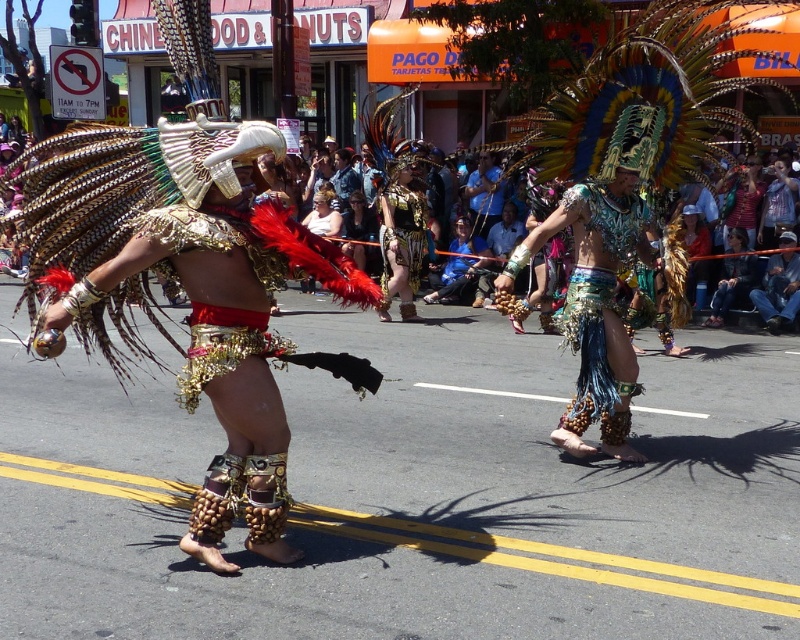
Question: Which point appears closest to the camera in this image?

Choices:
 (A) (388, 230)
 (B) (204, 307)

Answer: (B)

Question: Estimate the real-world distances between objects in this image. Which object is farther from the shiny gold feathers at center?

Choices:
 (A) shiny metallic headdress at center
 (B) metallic gold armor at center

Answer: (B)

Question: Can you confirm if shiny gold feathers at center is positioned above shiny metallic headdress at center?

Choices:
 (A) yes
 (B) no

Answer: (B)

Question: Can you confirm if blue metallic skirt at center is positioned below metallic gold armor at center?

Choices:
 (A) yes
 (B) no

Answer: (A)

Question: Does shiny gold feathers at center come behind shiny metallic headdress at center?

Choices:
 (A) yes
 (B) no

Answer: (B)

Question: Among these points, which one is farthest from the camera?

Choices:
 (A) (392, 186)
 (B) (110, 177)
 (C) (600, 305)

Answer: (A)